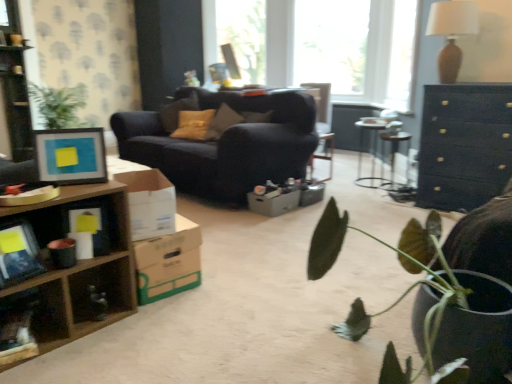
Question: Should I look upward or downward to see metallic silver desk at center?

Choices:
 (A) down
 (B) up

Answer: (B)

Question: Is wooden bookshelf at left at the right side of cardboard box at center, arranged as the first cardboard box when viewed from the right?

Choices:
 (A) no
 (B) yes

Answer: (A)

Question: Is wooden bookshelf at left further to camera compared to cardboard box at center, which ranks as the first cardboard box in back-to-front order?

Choices:
 (A) yes
 (B) no

Answer: (A)

Question: Is wooden bookshelf at left aimed at cardboard box at center, arranged as the first cardboard box when viewed from the right?

Choices:
 (A) yes
 (B) no

Answer: (A)

Question: From the image's perspective, is wooden bookshelf at left beneath cardboard box at center, which ranks as the first cardboard box in back-to-front order?

Choices:
 (A) yes
 (B) no

Answer: (B)

Question: Is wooden bookshelf at left positioned in front of cardboard box at center, which ranks as the first cardboard box in back-to-front order?

Choices:
 (A) no
 (B) yes

Answer: (A)

Question: Does wooden bookshelf at left have a lesser height compared to cardboard box at center, which appears as the 3th cardboard box when viewed from the front?

Choices:
 (A) no
 (B) yes

Answer: (A)

Question: Is cardboard box at center, arranged as the first cardboard box when viewed from the right, directly adjacent to matte brown pillow at center?

Choices:
 (A) yes
 (B) no

Answer: (B)

Question: Is cardboard box at center, arranged as the first cardboard box when viewed from the right, facing away from matte brown pillow at center?

Choices:
 (A) yes
 (B) no

Answer: (B)

Question: From the image's perspective, is cardboard box at center, the third cardboard box from the left, on top of matte brown pillow at center?

Choices:
 (A) yes
 (B) no

Answer: (B)

Question: Is cardboard box at center, arranged as the first cardboard box when viewed from the right, surrounding matte brown pillow at center?

Choices:
 (A) yes
 (B) no

Answer: (B)

Question: Does cardboard box at center, which ranks as the first cardboard box in back-to-front order, have a larger size compared to matte brown pillow at center?

Choices:
 (A) no
 (B) yes

Answer: (A)

Question: Does cardboard box at center, arranged as the first cardboard box when viewed from the right, appear on the left side of matte brown pillow at center?

Choices:
 (A) no
 (B) yes

Answer: (A)

Question: Considering the relative sizes of white cardboard box at center, the first cardboard box positioned from the front, and cardboard box at lower left, which is counted as the second cardboard box, starting from the right, in the image provided, is white cardboard box at center, the first cardboard box positioned from the front, thinner than cardboard box at lower left, which is counted as the second cardboard box, starting from the right,?

Choices:
 (A) yes
 (B) no

Answer: (A)